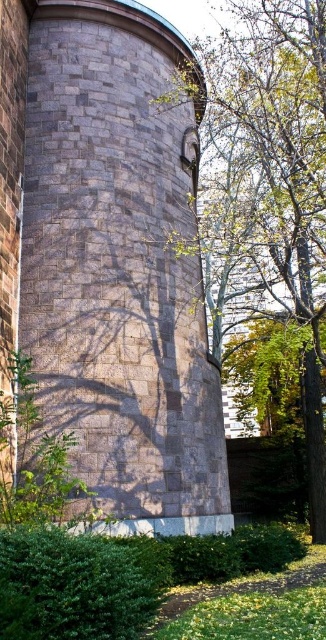
Consider the image. Can you confirm if gray stone tower at center is shorter than green leafy tree at center?

Yes.

Who is positioned more to the left, gray stone tower at center or green leafy tree at center?

gray stone tower at center is more to the left.

At what (x,y) coordinates should I click in order to perform the action: click on gray stone tower at center. Please return your answer as a coordinate pair (x, y). Image resolution: width=326 pixels, height=640 pixels. Looking at the image, I should click on (108, 259).

Locate an element on the screen. The width and height of the screenshot is (326, 640). gray stone tower at center is located at coordinates (108, 259).